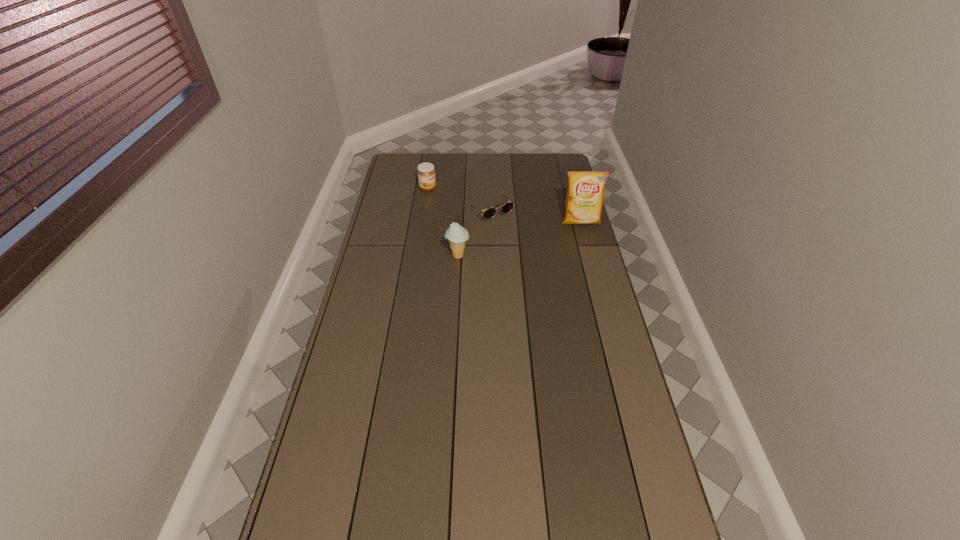
The width and height of the screenshot is (960, 540). What are the coordinates of `unoccupied position between the crisp (potato chip) and the shortest object` in the screenshot? It's located at (536, 217).

The image size is (960, 540). I want to click on the third closest object relative to the sunglasses, so click(585, 194).

Locate an element on the screen. This screenshot has width=960, height=540. object that is the third closest to the second tallest object is located at coordinates (585, 194).